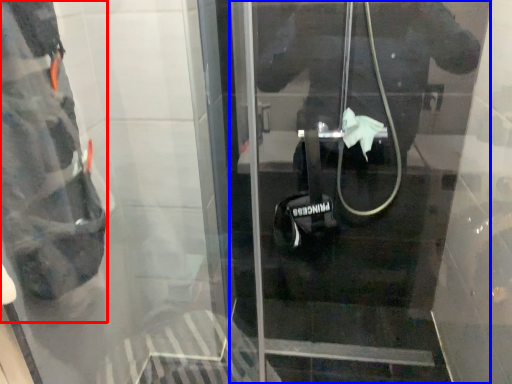
Question: Which object is further to the camera taking this photo, wide (highlighted by a red box) or door (highlighted by a blue box)?

Choices:
 (A) wide
 (B) door

Answer: (A)